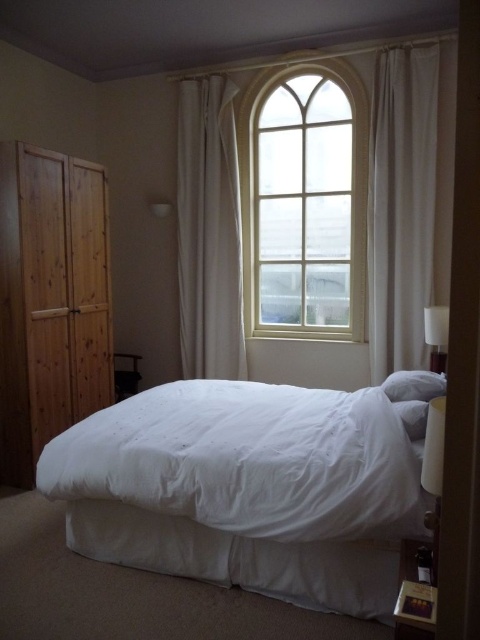
You are standing in the bedroom and want to reach the wooden wardrobe at left and the white sheer curtain at right. Which object is closer to you?

The wooden wardrobe at left is closer to the viewer than the white sheer curtain at right, so you can reach it first.

You are moving a small table that is 0.5 meters wide. You want to place it between the wooden wardrobe at left and the white sheer curtain at right. Can the table fit in the space between them?

The wooden wardrobe at left is larger in size than the white sheer curtain at right, but the description does not specify the exact distance between them. Therefore, it is uncertain if the table will fit.